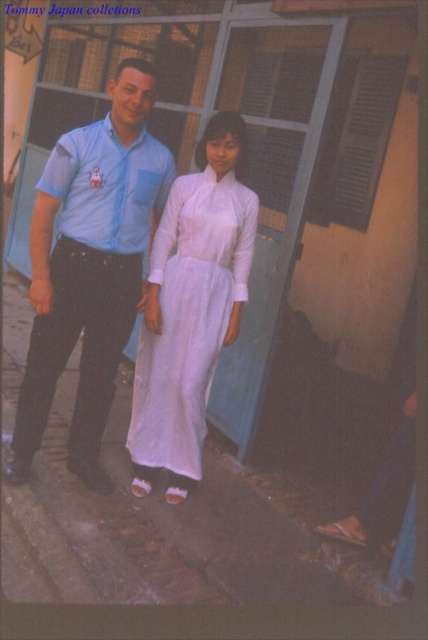
Question: Can you confirm if matte blue shirt at center is thinner than white silk dress at center?

Choices:
 (A) no
 (B) yes

Answer: (A)

Question: Considering the real-world distances, which object is farthest from the matte blue shirt at center?

Choices:
 (A) matte blue shirt at left
 (B) white silk dress at center

Answer: (B)

Question: Which object is farther from the camera taking this photo?

Choices:
 (A) white silk dress at center
 (B) matte blue shirt at center

Answer: (A)

Question: Estimate the real-world distances between objects in this image. Which object is farther from the matte blue shirt at left?

Choices:
 (A) matte blue shirt at center
 (B) white silk dress at center

Answer: (B)

Question: Is the position of white silk dress at center more distant than that of matte blue shirt at left?

Choices:
 (A) yes
 (B) no

Answer: (A)

Question: Is white silk dress at center positioned before matte blue shirt at left?

Choices:
 (A) yes
 (B) no

Answer: (B)